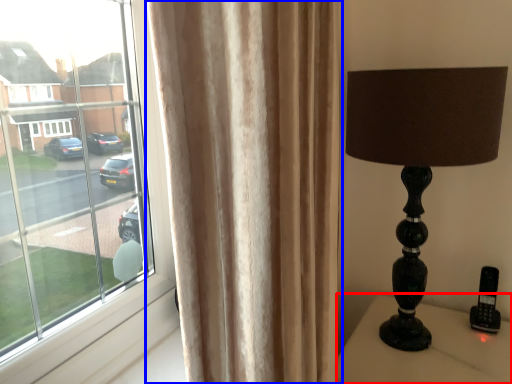
Question: Which point is closer to the camera, furniture (highlighted by a red box) or curtain (highlighted by a blue box)?

Choices:
 (A) furniture
 (B) curtain

Answer: (B)